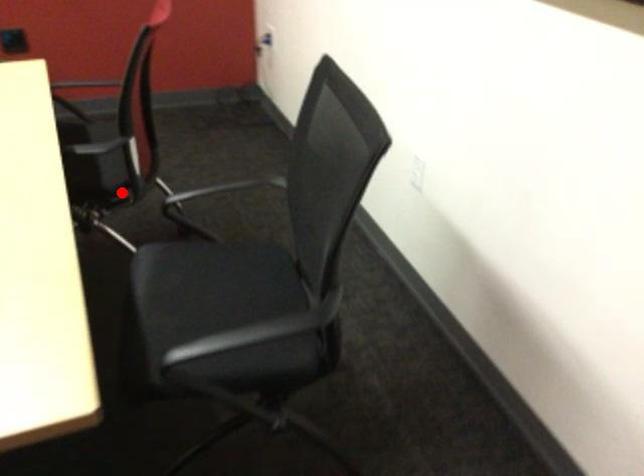
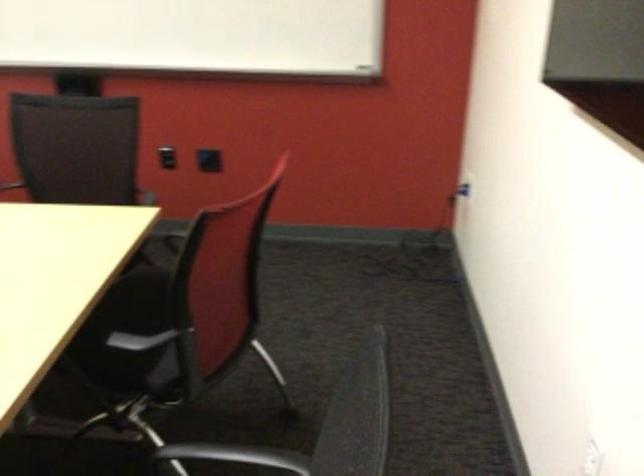
Question: I am providing you with two images of the same scene from different viewpoints. Image1 has a red point marked. In image2, the corresponding 3D location appears at what relative position? Reply with the corresponding letter.

Choices:
 (A) Closer
 (B) Farther

Answer: (A)